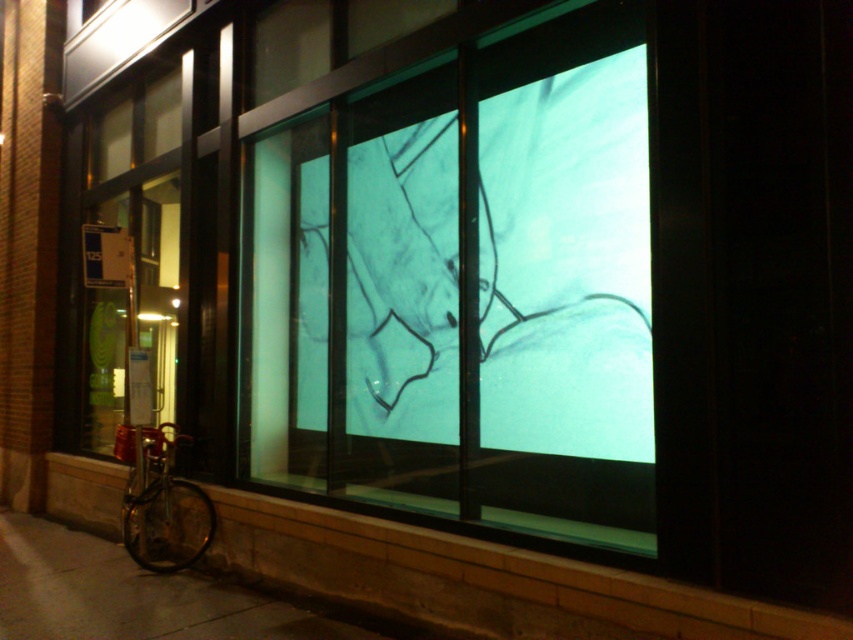
You are a delivery person standing in front of the storefront window. You need to place a small package on the shiny metallic bicycle at lower left. Can you place it on the transparent glass drawing at center without touching the bicycle?

The transparent glass drawing at center is above the shiny metallic bicycle at lower left, so you can place the package on the transparent glass drawing at center without touching the bicycle.

You are a delivery person trying to find the storefront window. According to the image, where exactly is the transparent glass drawing at center located?

The transparent glass drawing at center is located at point coordinates of 0.452 on the x axis and 0.545 on the y axis.